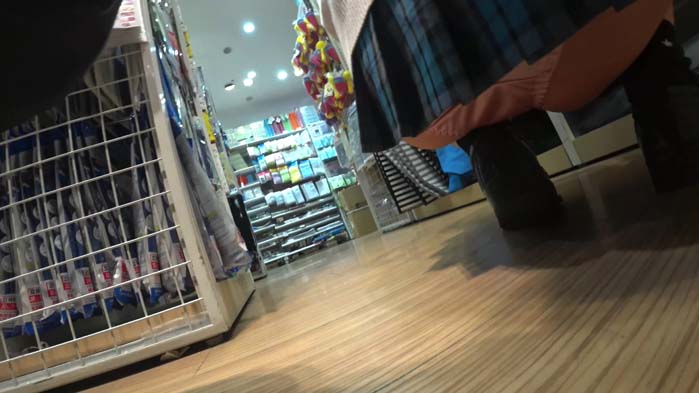
Image resolution: width=699 pixels, height=393 pixels. Find the location of `shelf`. shelf is located at coordinates (233, 208).